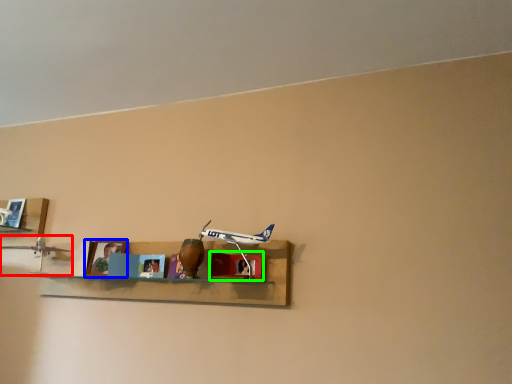
Question: Estimate the real-world distances between objects in this image. Which object is farther from toy (highlighted by a red box), picture frame (highlighted by a blue box) or cabinet (highlighted by a green box)?

Choices:
 (A) picture frame
 (B) cabinet

Answer: (B)